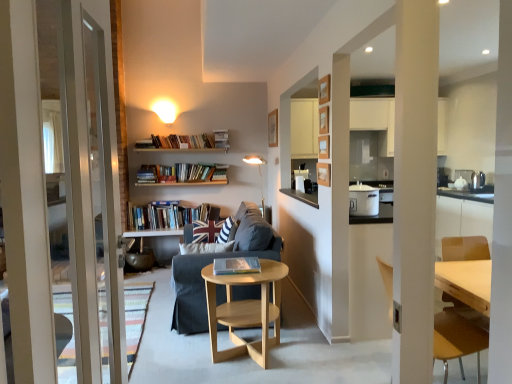
Question: Is light brown wooden chair at right wider or thinner than hardcover books at center, the second book in the right-to-left sequence?

Choices:
 (A) thin
 (B) wide

Answer: (B)

Question: In the image, is light brown wooden chair at right positioned in front of or behind hardcover books at center, placed as the second book when sorted from front to back?

Choices:
 (A) behind
 (B) front

Answer: (B)

Question: Considering the real-world distances, which object is farthest from the gold metallic floor lamp at center?

Choices:
 (A) light wood/woodenobject at center
 (B) hardcover book at center, which appears as the first book when viewed from the right
 (C) hardcover books at center, the second book in the right-to-left sequence
 (D) light brown wooden chair at right
 (E) striped fabric pillow at center

Answer: (D)

Question: Which object is positioned farthest from the light wood/woodenobject at center?

Choices:
 (A) hardcover book at center, which appears as the second book when viewed from the back
 (B) dark gray fabric couch at center
 (C) metallic silver kettle at right, placed as the 1th appliance when sorted from right to left
 (D) white glossy pot at center-right, arranged as the 2th appliance when viewed from the right
 (E) gold metallic floor lamp at center

Answer: (C)